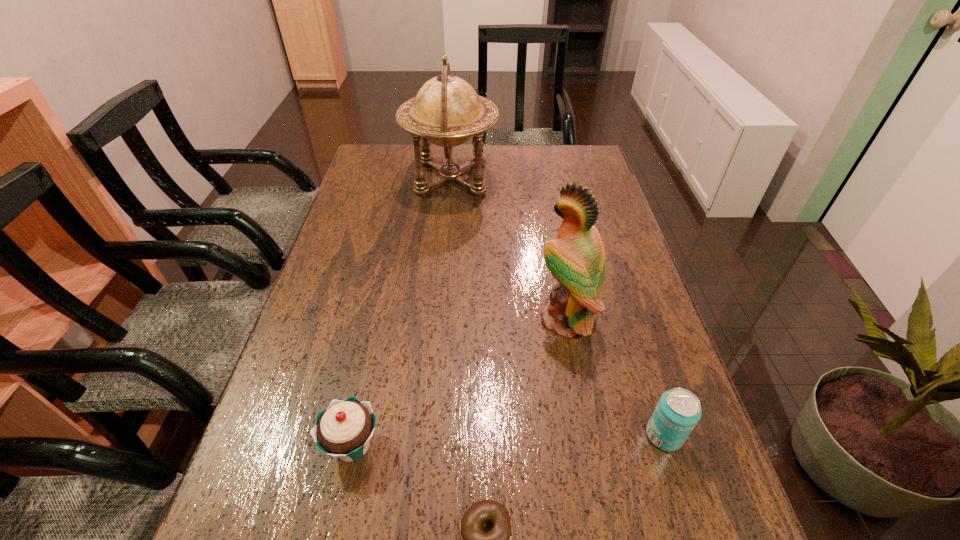
Find the location of `vacant region located on the back of the cupcake`. vacant region located on the back of the cupcake is located at coordinates (363, 394).

Locate an element on the screen. object that is at the far edge is located at coordinates (446, 111).

Locate an element on the screen. object that is positioned at the left edge is located at coordinates (344, 429).

Image resolution: width=960 pixels, height=540 pixels. I want to click on parrot situated at the right edge, so pyautogui.click(x=576, y=259).

Identify the location of beer can located at the right edge. (678, 411).

In the image, there is a desktop. Where is `blank space at the far edge`? blank space at the far edge is located at coordinates (439, 162).

In order to click on vacant space at the left edge in this screenshot , I will do `click(358, 294)`.

Locate an element on the screen. The width and height of the screenshot is (960, 540). vacant region at the right edge of the desktop is located at coordinates (663, 335).

The width and height of the screenshot is (960, 540). Find the location of `vacant area at the far right corner of the desktop`. vacant area at the far right corner of the desktop is located at coordinates (579, 164).

This screenshot has width=960, height=540. I want to click on unoccupied position between the globe and the cupcake, so click(x=401, y=311).